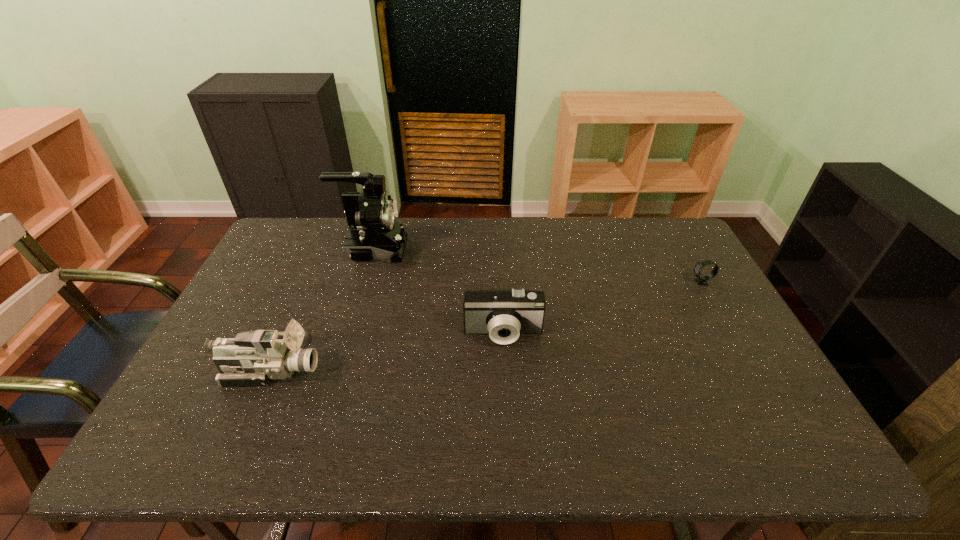
Locate an element on the screen. The width and height of the screenshot is (960, 540). vacant area that lies between the tallest camcorder and the rightmost object is located at coordinates (538, 266).

Choose which object is the third nearest neighbor to the second farthest object. Please provide its 2D coordinates. Your answer should be formatted as a tuple, i.e. [(x, y)], where the tuple contains the x and y coordinates of a point satisfying the conditions above.

[(253, 358)]

Locate which object ranks third in proximity to the farthest object. Please provide its 2D coordinates. Your answer should be formatted as a tuple, i.e. [(x, y)], where the tuple contains the x and y coordinates of a point satisfying the conditions above.

[(701, 280)]

The image size is (960, 540). What are the coordinates of `the closest camcorder to the tallest camcorder` in the screenshot? It's located at (503, 314).

Choose which camcorder is the nearest neighbor to the third farthest object. Please provide its 2D coordinates. Your answer should be formatted as a tuple, i.e. [(x, y)], where the tuple contains the x and y coordinates of a point satisfying the conditions above.

[(374, 233)]

Where is `vacant region that satisfies the following two spatial constraints: 1. on the lens of the rightmost camcorder; 2. on the front-facing side of the second shortest camcorder`? The width and height of the screenshot is (960, 540). vacant region that satisfies the following two spatial constraints: 1. on the lens of the rightmost camcorder; 2. on the front-facing side of the second shortest camcorder is located at coordinates (x=505, y=370).

Where is `free space in the image that satisfies the following two spatial constraints: 1. on the lens of the shortest camcorder; 2. on the front-facing side of the second shortest camcorder`? free space in the image that satisfies the following two spatial constraints: 1. on the lens of the shortest camcorder; 2. on the front-facing side of the second shortest camcorder is located at coordinates (505, 370).